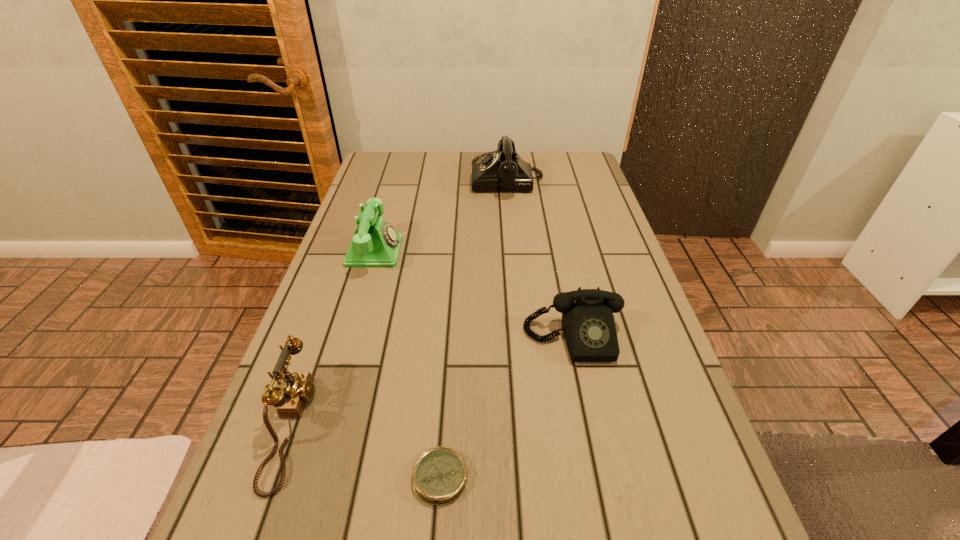
Identify which object is the closest to the farthest object. Please provide its 2D coordinates. Your answer should be formatted as a tuple, i.e. [(x, y)], where the tuple contains the x and y coordinates of a point satisfying the conditions above.

[(375, 243)]

I want to click on telephone that stands as the closest to the second farthest object, so click(x=502, y=170).

Identify which telephone is the third nearest to the shortest telephone. Please provide its 2D coordinates. Your answer should be formatted as a tuple, i.e. [(x, y)], where the tuple contains the x and y coordinates of a point satisfying the conditions above.

[(502, 170)]

Identify the location of vacant space that satisfies the following two spatial constraints: 1. on the front-facing side of the nearest telephone; 2. on the back side of the shortest object. (x=273, y=477).

This screenshot has height=540, width=960. What are the coordinates of `free space that satisfies the following two spatial constraints: 1. on the back side of the shortest object; 2. on the dial of the second farthest telephone` in the screenshot? It's located at (456, 251).

In order to click on blank area in the image that satisfies the following two spatial constraints: 1. on the dial of the third nearest telephone; 2. on the back side of the shortest object in this screenshot , I will do `click(309, 477)`.

In order to click on free space that satisfies the following two spatial constraints: 1. on the back side of the shortest object; 2. on the front-facing side of the nearest telephone in this screenshot , I will do `click(444, 426)`.

The height and width of the screenshot is (540, 960). What are the coordinates of `vacant space that satisfies the following two spatial constraints: 1. on the front-facing side of the nearest telephone; 2. on the back side of the compass` in the screenshot? It's located at (273, 477).

At what (x,y) coordinates should I click in order to perform the action: click on vacant area in the image that satisfies the following two spatial constraints: 1. on the dial of the shortest telephone; 2. on the front-facing side of the nearest telephone. Please return your answer as a coordinate pair (x, y). This screenshot has width=960, height=540. Looking at the image, I should click on (592, 426).

Find the location of a particular element. Image resolution: width=960 pixels, height=540 pixels. free space that satisfies the following two spatial constraints: 1. on the dial of the second farthest object; 2. on the right side of the compass is located at coordinates (309, 477).